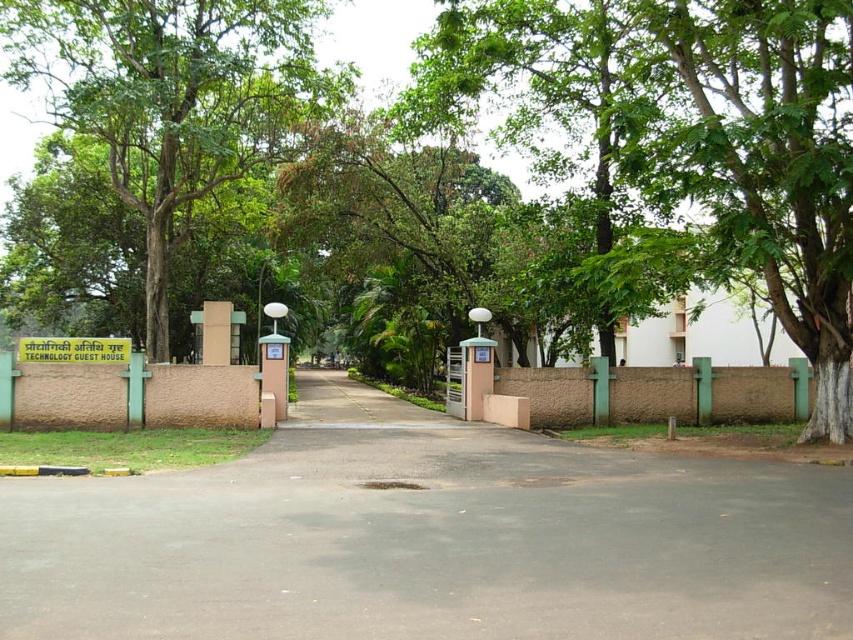
Question: Among these objects, which one is nearest to the camera?

Choices:
 (A) green leafy tree at left
 (B) green leafy tree at center
 (C) black asphalt driveway at center
 (D) green plastic sign at center

Answer: (C)

Question: Can you confirm if green leafy tree at left is smaller than green plastic sign at center?

Choices:
 (A) yes
 (B) no

Answer: (B)

Question: Is black asphalt driveway at center positioned behind green leafy tree at left?

Choices:
 (A) no
 (B) yes

Answer: (A)

Question: Considering the relative positions of green leafy tree at center and green leafy tree at left in the image provided, where is green leafy tree at center located with respect to green leafy tree at left?

Choices:
 (A) above
 (B) below

Answer: (B)

Question: Which object is positioned farthest from the black asphalt driveway at center?

Choices:
 (A) green plastic sign at center
 (B) green leafy tree at center

Answer: (A)

Question: Based on their relative distances, which object is nearer to the black asphalt driveway at center?

Choices:
 (A) green leafy tree at left
 (B) green plastic sign at center

Answer: (B)